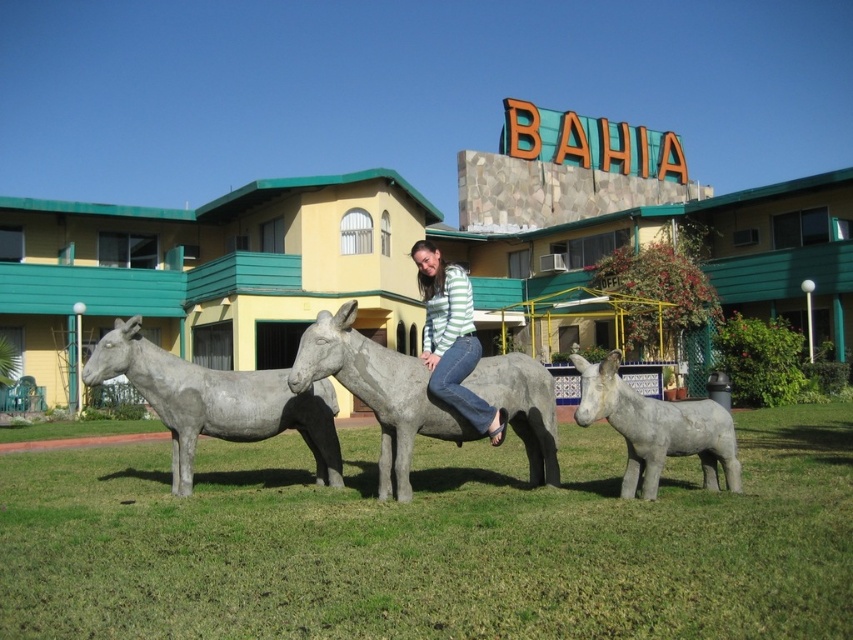
Question: Is gray stone donkey at lower right smaller than striped sweater at center?

Choices:
 (A) no
 (B) yes

Answer: (A)

Question: Which of the following is the farthest from the observer?

Choices:
 (A) gray stone donkey at center
 (B) gray stone donkey at lower right
 (C) striped sweater at center
 (D) gray stone mule at center

Answer: (C)

Question: Does gray stone donkey at center have a lesser width compared to striped sweater at center?

Choices:
 (A) yes
 (B) no

Answer: (B)

Question: Does gray stone donkey at lower right have a greater width compared to striped sweater at center?

Choices:
 (A) yes
 (B) no

Answer: (A)

Question: Which point appears closest to the camera in this image?

Choices:
 (A) (444, 413)
 (B) (651, 404)
 (C) (200, 371)
 (D) (444, 282)

Answer: (B)

Question: Considering the real-world distances, which object is farthest from the gray stone donkey at lower right?

Choices:
 (A) gray stone mule at center
 (B) striped sweater at center
 (C) gray stone donkey at center

Answer: (C)